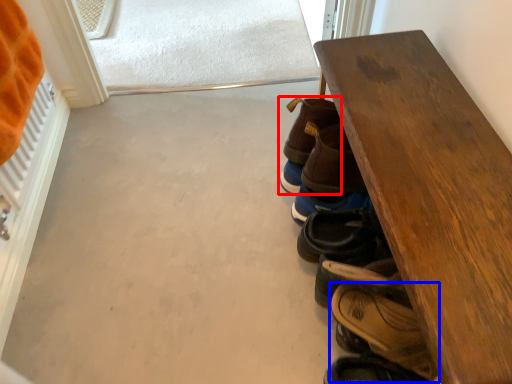
Question: Which object is closer to the camera taking this photo, footwear (highlighted by a red box) or footwear (highlighted by a blue box)?

Choices:
 (A) footwear
 (B) footwear

Answer: (B)